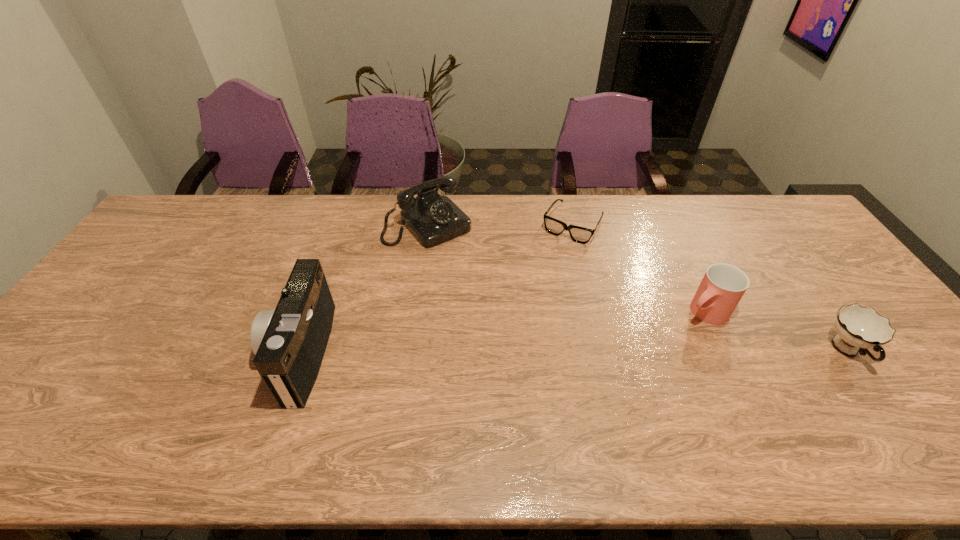
Locate an element on the screen. This screenshot has height=540, width=960. free spot on the desktop that is between the camcorder and the shorter cup and is positioned on the dial of the second object from left to right is located at coordinates (544, 352).

This screenshot has height=540, width=960. Find the location of `vacant spot on the desktop that is between the tallest object and the right cup and is positioned on the front-facing side of the sunglasses`. vacant spot on the desktop that is between the tallest object and the right cup and is positioned on the front-facing side of the sunglasses is located at coordinates tap(493, 352).

Locate an element on the screen. The width and height of the screenshot is (960, 540). vacant spot on the desktop that is between the camcorder and the right cup and is positioned on the side of the left cup with the handle is located at coordinates (651, 352).